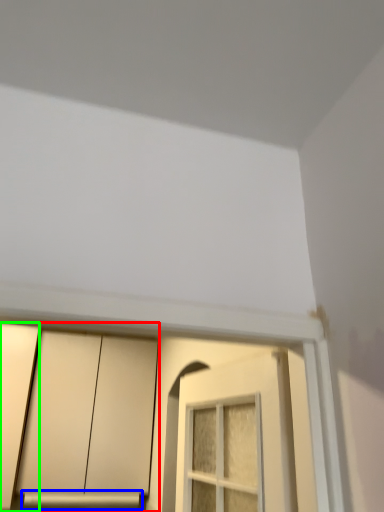
Question: Which object is positioned closest to cabinetry (highlighted by a red box)? Select from window sill (highlighted by a blue box) and door (highlighted by a green box).

Choices:
 (A) window sill
 (B) door

Answer: (B)